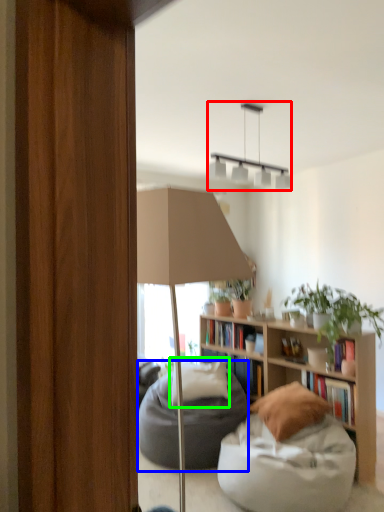
Question: Considering the real-world distances, which object is closest to lamp (highlighted by a red box)? bean bag chair (highlighted by a blue box) or pillow (highlighted by a green box).

Choices:
 (A) bean bag chair
 (B) pillow

Answer: (B)